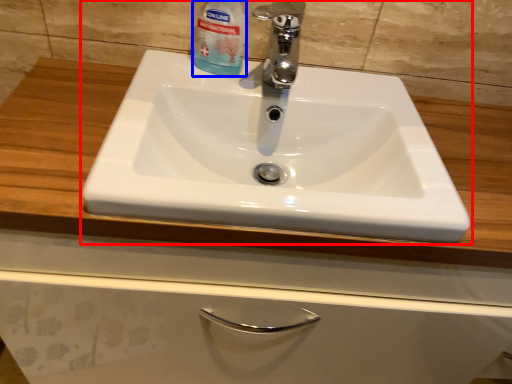
Question: Which of the following is the farthest to the observer, sink (highlighted by a red box) or cleaning product (highlighted by a blue box)?

Choices:
 (A) sink
 (B) cleaning product

Answer: (B)